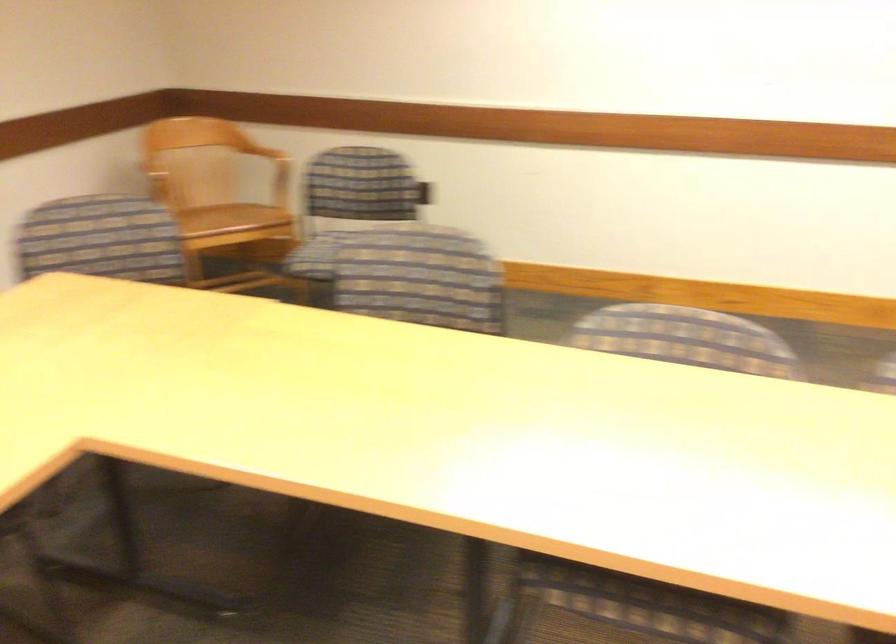
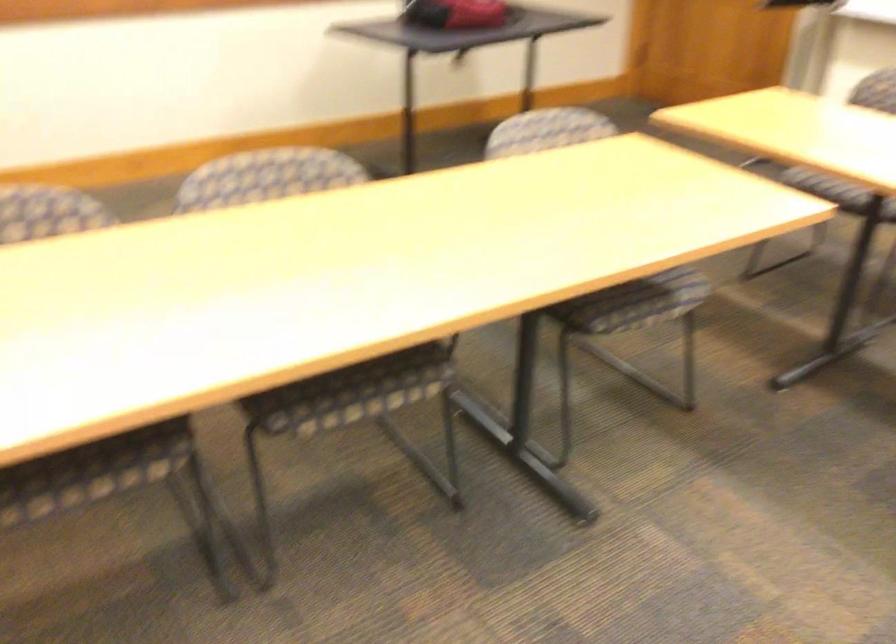
Question: The camera is either moving clockwise (left) or counter-clockwise (right) around the object. The first image is from the beginning of the video and the second image is from the end. Is the camera moving left or right when shooting the video?

Choices:
 (A) Left
 (B) Right

Answer: (A)